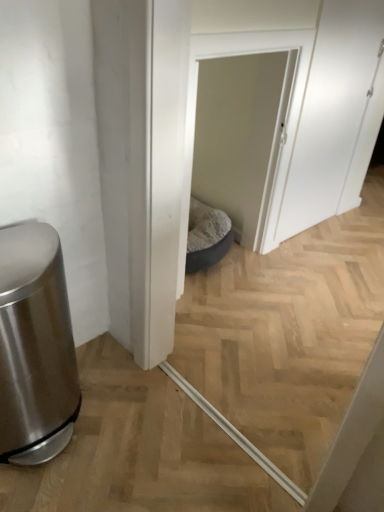
Find the location of a particular element. vacant space in front of white matte screen door at upper right, which is the 1th screen door from right to left is located at coordinates (320, 260).